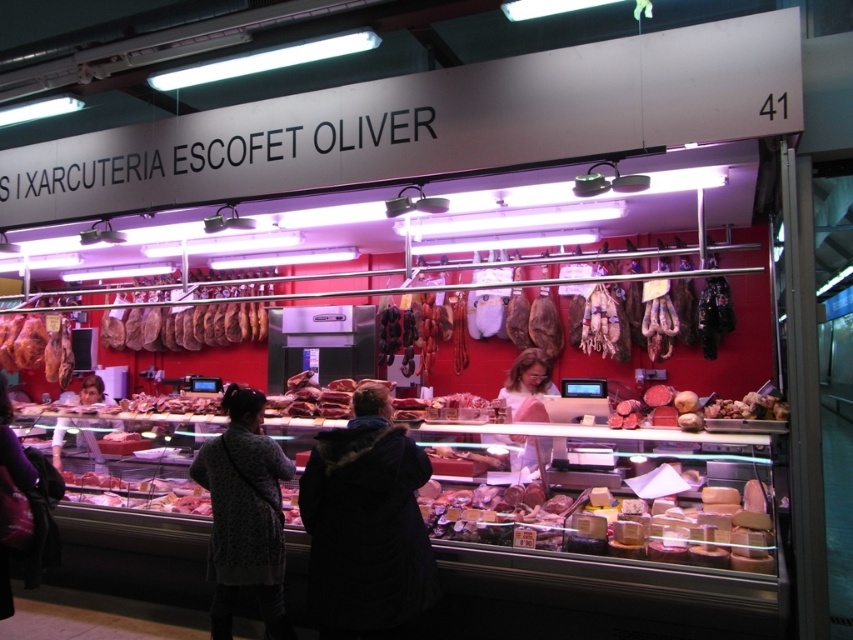
You are a customer at the meat counter and want to know what is at the center of the counter. According to the coordinates provided, what object is located at point [527,384]?

The white matte shirt at center is located at point [527,384].

You are a customer at the meat counter and want to place the white cheese at center on top of the dark blue coat at center. Based on their sizes, will this arrangement be stable?

The dark blue coat at center has a greater height compared to the white cheese at center. Therefore, placing the white cheese at center on top of the dark blue coat at center would be stable since the coat is taller and can provide a stable base.

What is the color of the object located at point (366,525)?

The object at point (366,525) is a dark blue coat at center.